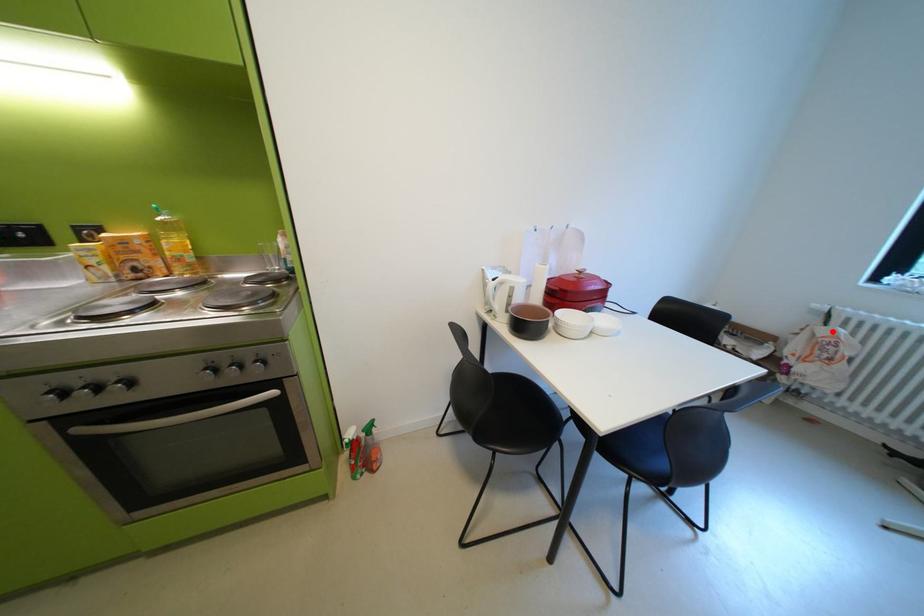
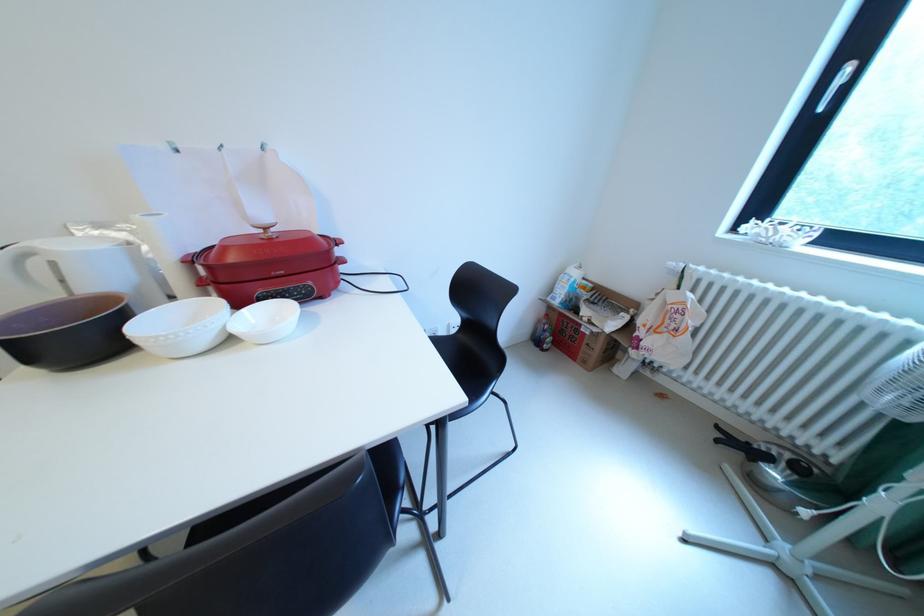
In the second image, find the point that corresponds to the highlighted location in the first image.

(682, 297)